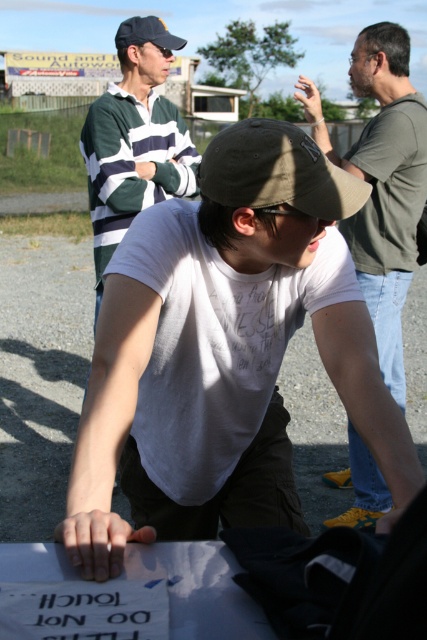
You are a delivery person who needs to place a 1.5 meter long package between the green striped sweater at upper left and the khaki fabric baseball cap at center. Is there enough space?

The distance between the green striped sweater at upper left and the khaki fabric baseball cap at center is 1.69 meters, so yes, the 1.5 meter long package can fit between them since the space is wider than the package.